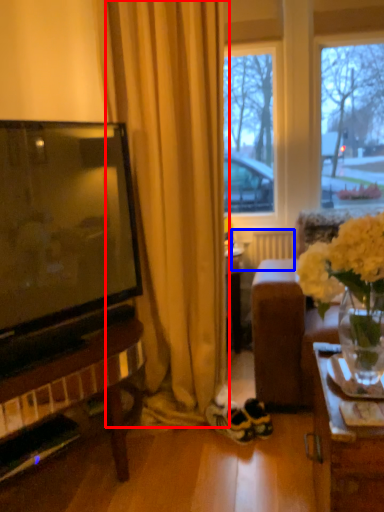
Question: Among these objects, which one is farthest to the camera, curtain (highlighted by a red box) or radiator (highlighted by a blue box)?

Choices:
 (A) curtain
 (B) radiator

Answer: (B)